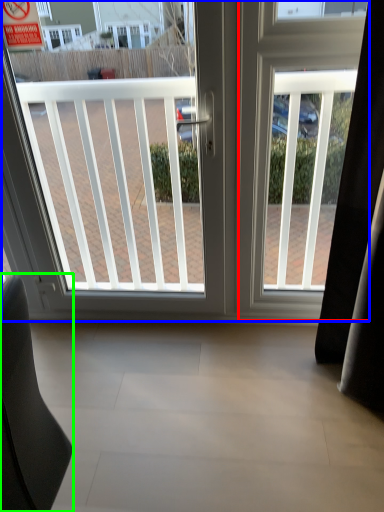
Question: Considering the real-world distances, which object is farthest from screen door (highlighted by a red box)? window (highlighted by a blue box) or furniture (highlighted by a green box)?

Choices:
 (A) window
 (B) furniture

Answer: (B)